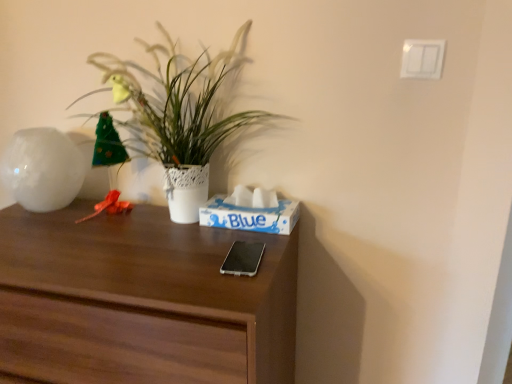
Question: Looking at the image, does silver metallic phone at center seem bigger or smaller compared to white lace pot at upper left?

Choices:
 (A) small
 (B) big

Answer: (A)

Question: Is point (238, 263) positioned closer to the camera than point (159, 72)?

Choices:
 (A) closer
 (B) farther

Answer: (A)

Question: Which of these objects is positioned closest to the white glossy vase at left?

Choices:
 (A) silver metallic phone at center
 (B) blue paper tissue box at center
 (C) dark wood desk at center
 (D) white lace pot at upper left

Answer: (D)

Question: Which is nearer to the white glossy vase at left?

Choices:
 (A) silver metallic phone at center
 (B) dark wood desk at center
 (C) white lace pot at upper left
 (D) blue paper tissue box at center

Answer: (C)